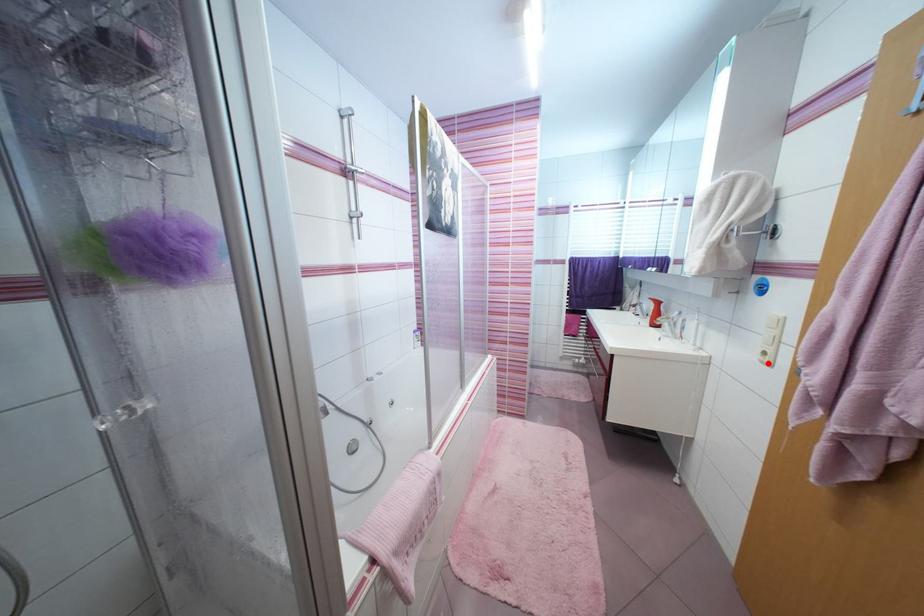
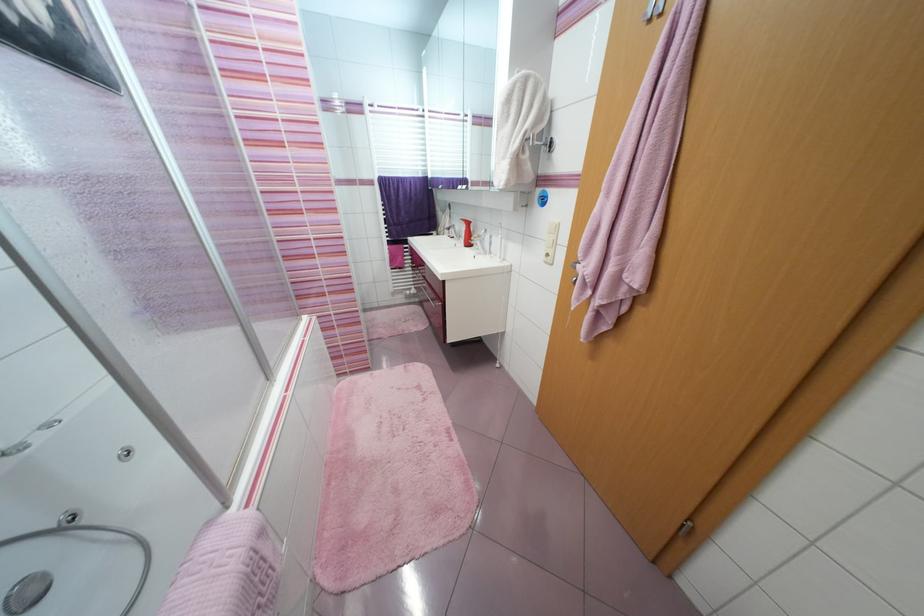
Find the pixel in the second image that matches the highlighted location in the first image.

(551, 264)